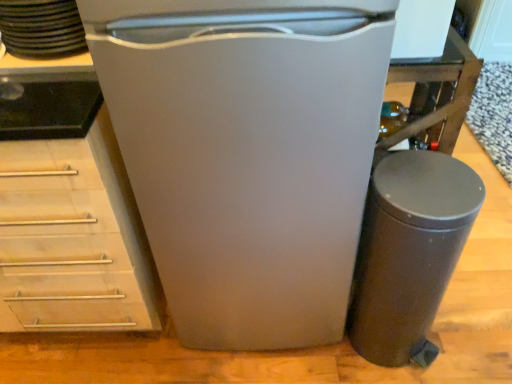
I want to click on free space above matte black trash can at lower right (from a real-world perspective), so click(424, 184).